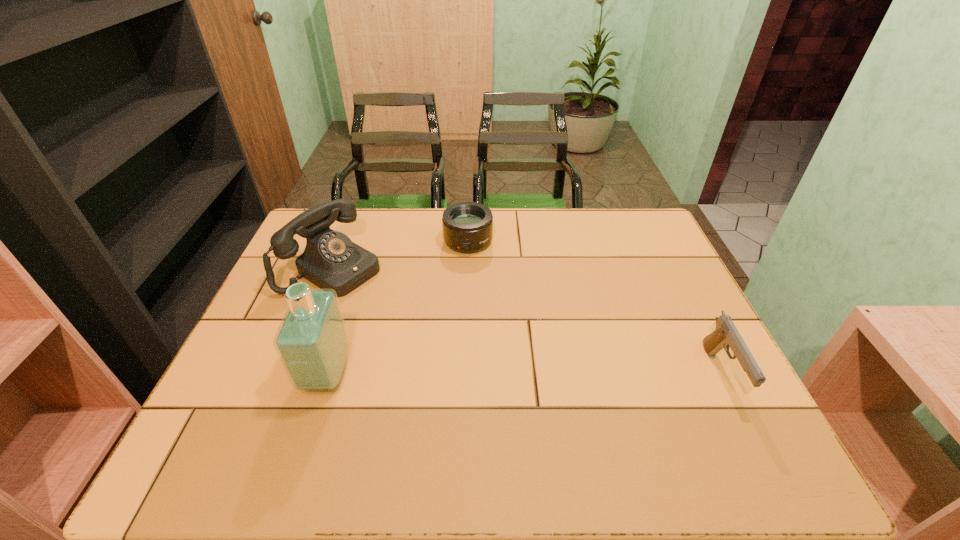
This screenshot has width=960, height=540. What are the coordinates of `vacant space on the desktop that is between the tallest object and the pistol and is positioned on the side of the telephoto lens with brand markings and control switches` in the screenshot? It's located at (488, 375).

Find the location of `vacant space on the desktop that is between the tallest object and the rightmost object and is positioned on the dial of the third shortest object`. vacant space on the desktop that is between the tallest object and the rightmost object and is positioned on the dial of the third shortest object is located at coordinates (510, 375).